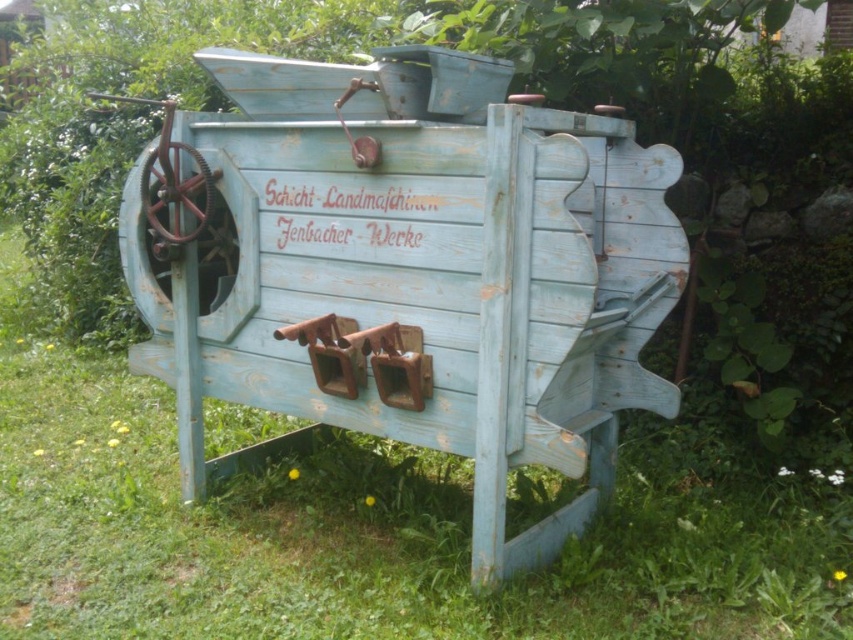
Who is lower down, distressed blue wood wagon at center or green grass at lower center?

green grass at lower center is below.

Is distressed blue wood wagon at center positioned before green grass at lower center?

That is True.

Between point (375, 96) and point (120, 369), which one is positioned in front?

Positioned in front is point (375, 96).

Identify the location of distressed blue wood wagon at center. The width and height of the screenshot is (853, 640). (413, 269).